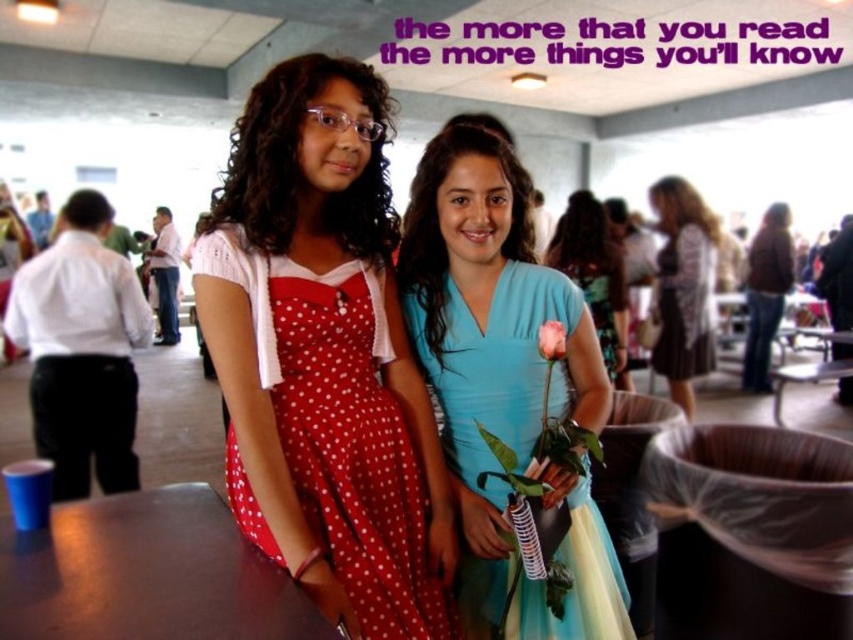
Question: Is matte blue dress at center thinner than brown leather jacket at center?

Choices:
 (A) no
 (B) yes

Answer: (B)

Question: Does red polka dot dress at center come behind pink matte rose at center?

Choices:
 (A) yes
 (B) no

Answer: (B)

Question: Which point appears closest to the camera in this image?

Choices:
 (A) (773, 220)
 (B) (471, 230)
 (C) (543, 332)

Answer: (C)

Question: Which point appears farthest from the camera in this image?

Choices:
 (A) (758, 234)
 (B) (547, 353)
 (C) (480, 572)

Answer: (A)

Question: Which object appears closest to the camera in this image?

Choices:
 (A) brown leather jacket at center
 (B) matte blue dress at center
 (C) brown textured dress at center

Answer: (B)

Question: Where is teal satin dress at center located in relation to brown textured dress at center in the image?

Choices:
 (A) above
 (B) below

Answer: (B)